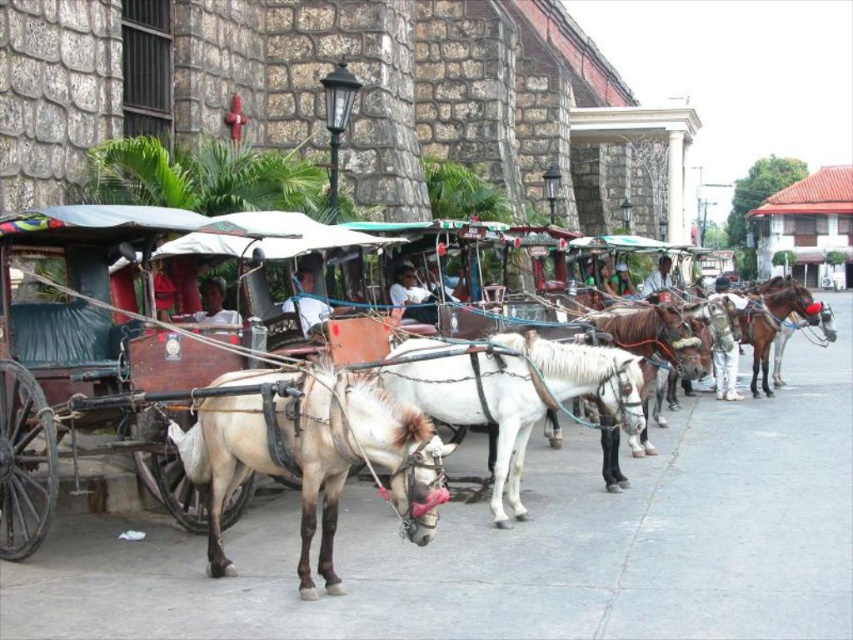
Which is above, light brown leather donkey at center or white glossy horse at center?

white glossy horse at center is above.

Is point (427, 493) more distant than point (451, 406)?

That is False.

The height and width of the screenshot is (640, 853). I want to click on light brown leather donkey at center, so click(x=314, y=454).

Is red fabric shirt at center thinner than white matte shirt at center?

Yes, red fabric shirt at center is thinner than white matte shirt at center.

Between red fabric shirt at center and white matte shirt at center, which one appears on the left side from the viewer's perspective?

Positioned to the left is red fabric shirt at center.

Is point (167, 284) positioned behind point (648, 278)?

That is False.

Locate an element on the screen. red fabric shirt at center is located at coordinates (163, 292).

Is light blue fabric at center shorter than white matte shirt at center?

Indeed, light blue fabric at center has a lesser height compared to white matte shirt at center.

Who is more forward, (x=318, y=301) or (x=653, y=292)?

Point (x=318, y=301) is in front.

Locate an element on the screen. This screenshot has height=640, width=853. light blue fabric at center is located at coordinates (306, 301).